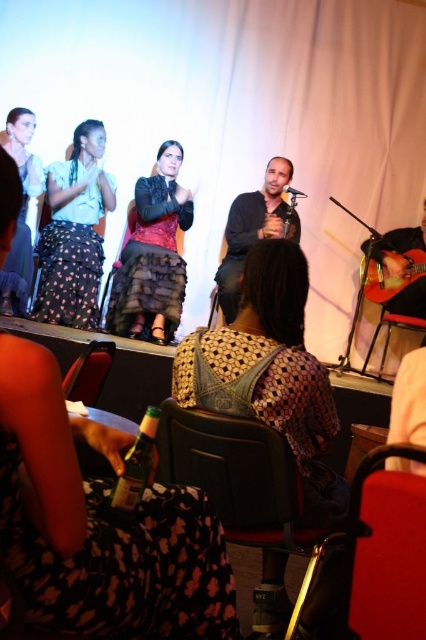
Between green glass bottle at lower left and acoustic guitar at right, which one is positioned lower?

Positioned lower is green glass bottle at lower left.

Between point (141, 493) and point (405, 262), which one is positioned behind?

The point (405, 262) is more distant.

The height and width of the screenshot is (640, 426). What are the coordinates of `green glass bottle at lower left` in the screenshot? It's located at (132, 474).

In order to click on green glass bottle at lower left in this screenshot , I will do `click(132, 474)`.

Is ruffled black skirt at center to the right of matte black skirt at left from the viewer's perspective?

Correct, you'll find ruffled black skirt at center to the right of matte black skirt at left.

Does point (86, 611) come in front of point (60, 291)?

Yes, point (86, 611) is closer to viewer.

In order to click on ruffled black skirt at center in this screenshot , I will do `click(98, 524)`.

Is leather-like black chair at lower right to the right of matte black dress at left from the viewer's perspective?

Yes, leather-like black chair at lower right is to the right of matte black dress at left.

Measure the distance between leather-like black chair at lower right and camera.

They are 90.34 centimeters apart.

You are a GUI agent. You are given a task and a screenshot of the screen. Output one action in this format:
    pyautogui.click(x=<x>, y=<y>)
    Task: Click on the leather-like black chair at lower right
    Image resolution: width=426 pixels, height=640 pixels.
    Given the screenshot: What is the action you would take?
    pyautogui.click(x=385, y=550)